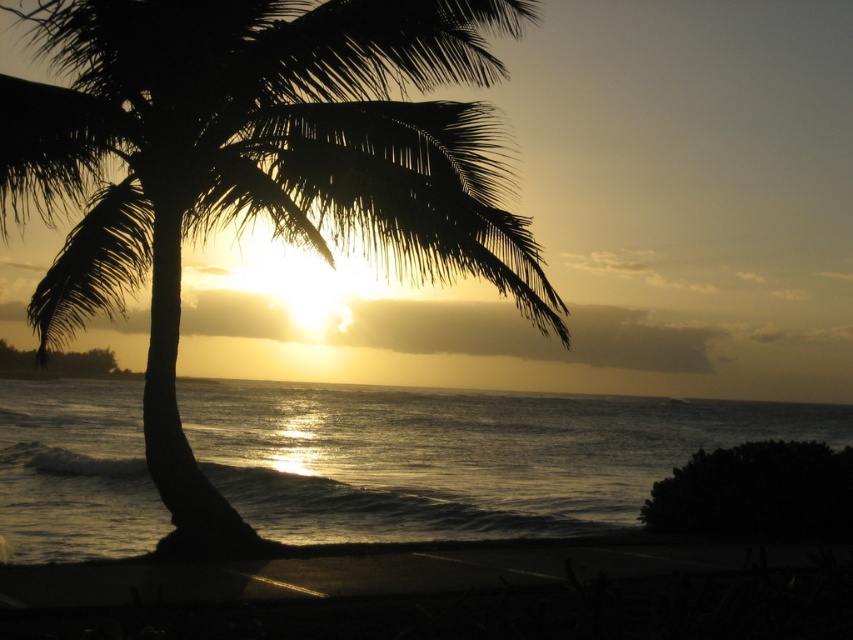
Who is more forward, (x=54, y=317) or (x=248, y=452)?

Point (x=54, y=317) is in front.

Which is behind, point (303, 166) or point (602, 436)?

Point (602, 436)

This screenshot has width=853, height=640. What are the coordinates of `silhouette leafy palm at center` in the screenshot? It's located at (254, 168).